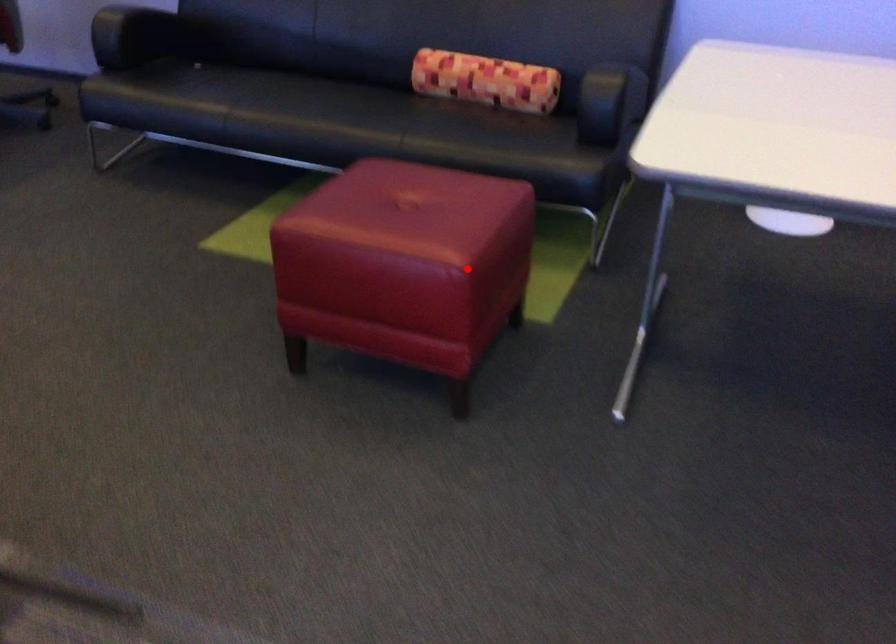
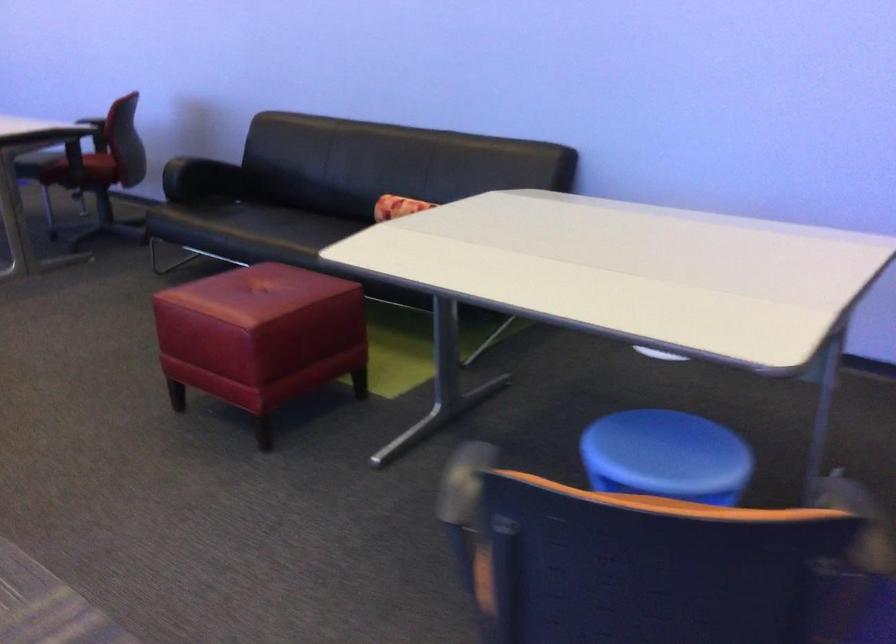
Where in the second image is the point corresponding to the highlighted location from the first image?

(261, 337)